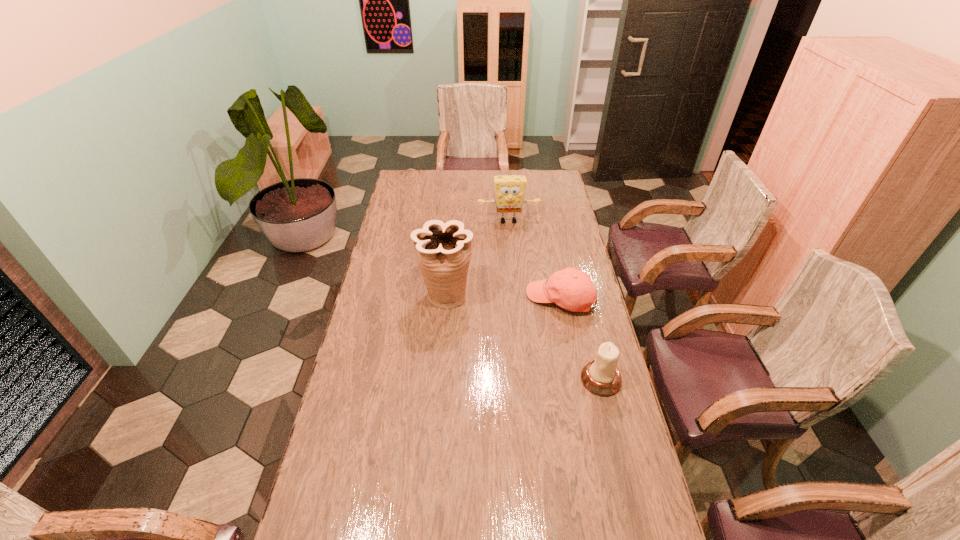
Identify the location of vacant space on the desktop that is between the leftmost object and the nearest object and is positioned on the front-facing side of the shortest object. The width and height of the screenshot is (960, 540). (507, 328).

The image size is (960, 540). I want to click on free space on the desktop that is between the urn and the third tallest object and is positioned on the face of the second tallest object, so click(523, 337).